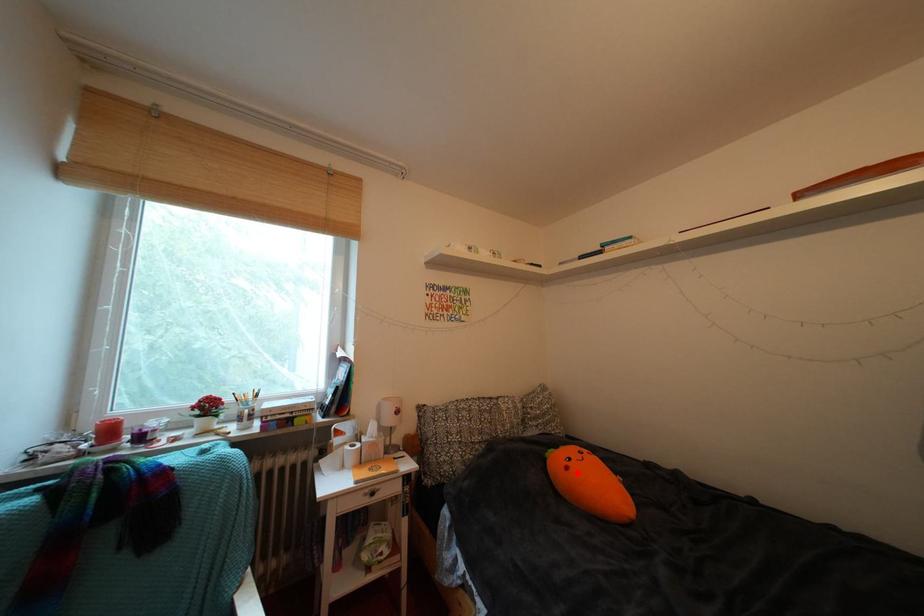
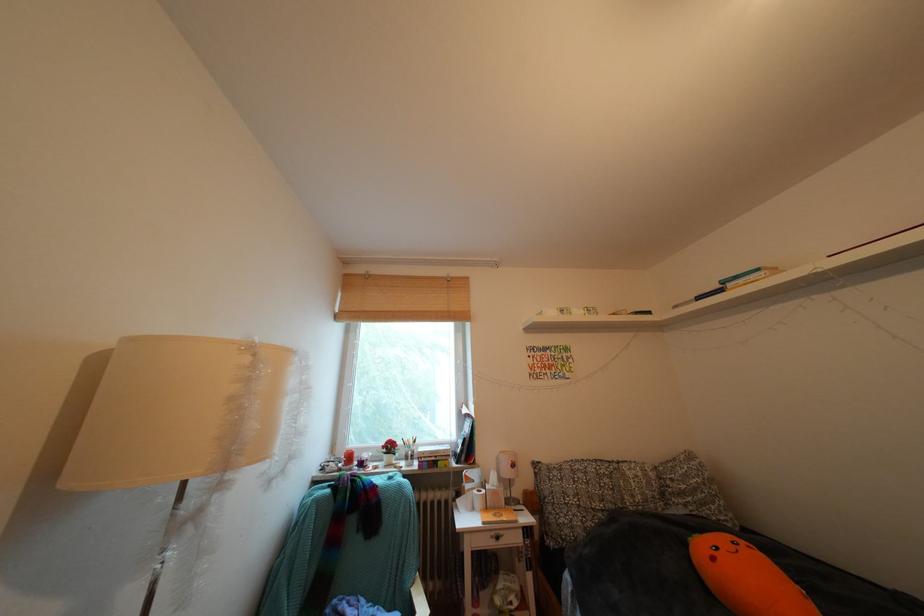
The point at the highlighted location is marked in the first image. Where is the corresponding point in the second image?

(723, 564)